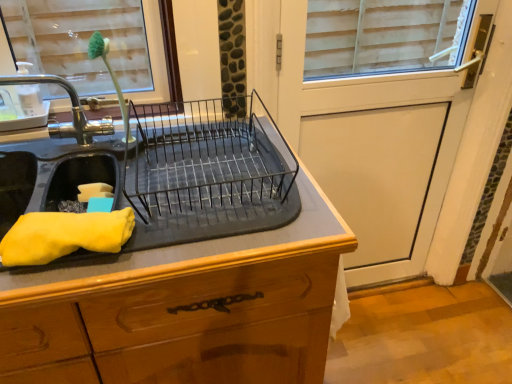
Where is `vacant area that is situated to the right of yellow fabric at left`? Image resolution: width=512 pixels, height=384 pixels. vacant area that is situated to the right of yellow fabric at left is located at coordinates (174, 240).